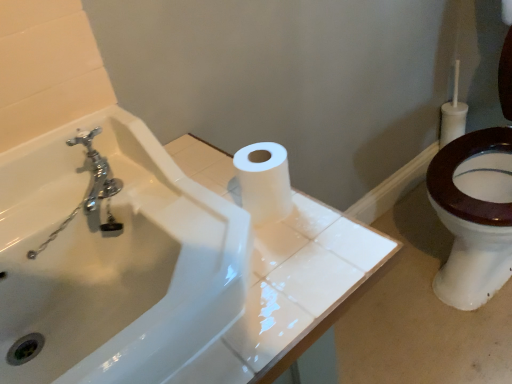
Question: Is white matte toilet paper at center thinner than white glossy sink at upper center?

Choices:
 (A) yes
 (B) no

Answer: (A)

Question: Are white matte toilet paper at center and white glossy sink at upper center far apart?

Choices:
 (A) yes
 (B) no

Answer: (B)

Question: Are white matte toilet paper at center and white glossy sink at upper center beside each other?

Choices:
 (A) no
 (B) yes

Answer: (A)

Question: Is white matte toilet paper at center looking in the opposite direction of white glossy sink at upper center?

Choices:
 (A) no
 (B) yes

Answer: (A)

Question: Is white matte toilet paper at center taller than white glossy sink at upper center?

Choices:
 (A) yes
 (B) no

Answer: (B)

Question: Considering the relative sizes of white matte toilet paper at center and white glossy sink at upper center in the image provided, is white matte toilet paper at center smaller than white glossy sink at upper center?

Choices:
 (A) yes
 (B) no

Answer: (A)

Question: Does white glossy sink at upper center have a greater width compared to white matte toilet paper at center?

Choices:
 (A) no
 (B) yes

Answer: (B)

Question: Does white glossy sink at upper center appear on the left side of white matte toilet paper at center?

Choices:
 (A) yes
 (B) no

Answer: (A)

Question: From the image's perspective, would you say white glossy sink at upper center is positioned over white matte toilet paper at center?

Choices:
 (A) no
 (B) yes

Answer: (A)

Question: Does white glossy sink at upper center have a greater height compared to white matte toilet paper at center?

Choices:
 (A) no
 (B) yes

Answer: (B)

Question: From a real-world perspective, is white glossy sink at upper center located beneath white matte toilet paper at center?

Choices:
 (A) yes
 (B) no

Answer: (A)

Question: Is white glossy sink at upper center to the right of white matte toilet paper at center from the viewer's perspective?

Choices:
 (A) yes
 (B) no

Answer: (B)

Question: In terms of width, does white glossy sink at upper center look wider or thinner when compared to white matte toilet paper at center?

Choices:
 (A) wide
 (B) thin

Answer: (A)